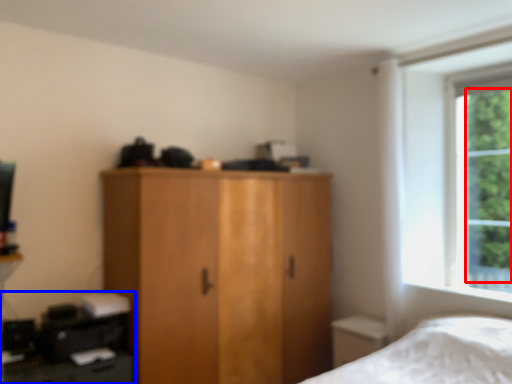
Question: Which point is further to the camera, tree (highlighted by a red box) or computer desk (highlighted by a blue box)?

Choices:
 (A) tree
 (B) computer desk

Answer: (A)